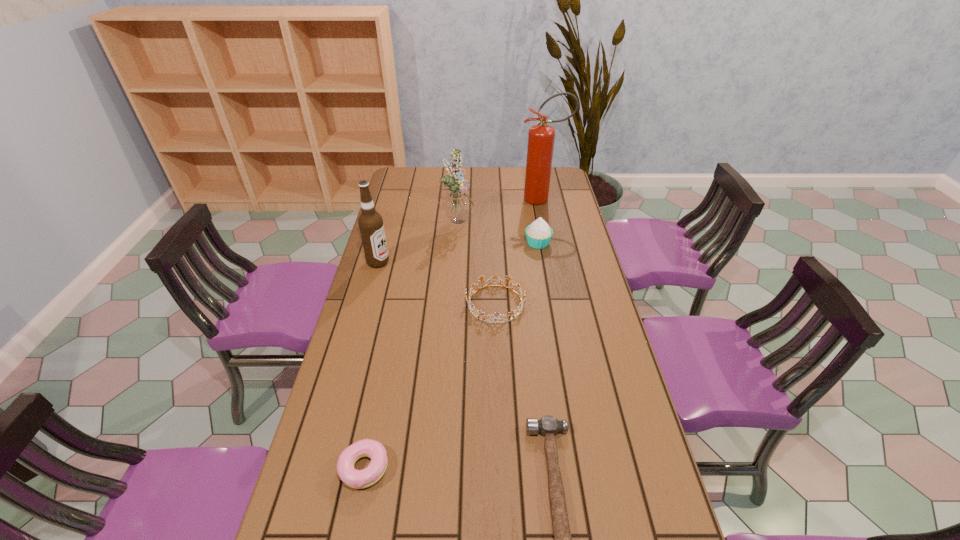
This screenshot has height=540, width=960. In order to click on vacant space located on the back of the sixth object from right to left in this screenshot , I will do `click(389, 345)`.

At what (x,y) coordinates should I click in order to perform the action: click on alcohol that is positioned at the left edge. Please return your answer as a coordinate pair (x, y). Looking at the image, I should click on (370, 222).

You are a GUI agent. You are given a task and a screenshot of the screen. Output one action in this format:
    pyautogui.click(x=<x>, y=<y>)
    Task: Click on the doughnut located in the left edge section of the desktop
    Image resolution: width=960 pixels, height=540 pixels.
    Given the screenshot: What is the action you would take?
    pyautogui.click(x=358, y=479)

Locate an element on the screen. Image resolution: width=960 pixels, height=540 pixels. fire extinguisher located in the right edge section of the desktop is located at coordinates (541, 137).

The width and height of the screenshot is (960, 540). What are the coordinates of `cupcake that is at the right edge` in the screenshot? It's located at (538, 234).

I want to click on blank space at the far edge of the desktop, so click(486, 173).

What are the coordinates of `vacant space at the left edge of the desktop` in the screenshot? It's located at (366, 395).

In the image, there is a desktop. At what (x,y) coordinates should I click in order to perform the action: click on free space at the right edge. Please return your answer as a coordinate pair (x, y). This screenshot has height=540, width=960. Looking at the image, I should click on (589, 362).

Find the location of a particular element. empty space between the sixth object from right to left and the fourth farthest object is located at coordinates (372, 365).

Locate an element on the screen. The height and width of the screenshot is (540, 960). free space between the doughnut and the second farthest object is located at coordinates (412, 344).